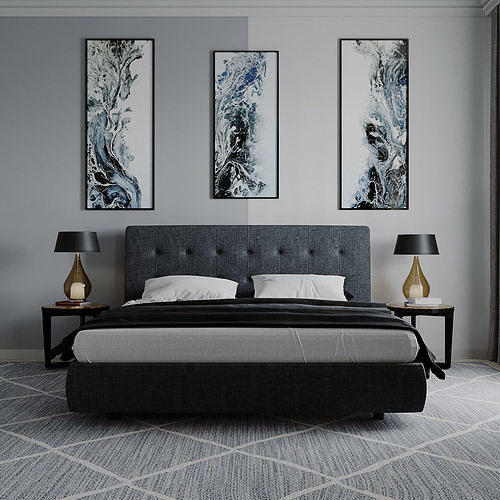
Image resolution: width=500 pixels, height=500 pixels. Find the location of `bedsheet`. bedsheet is located at coordinates (276, 335).